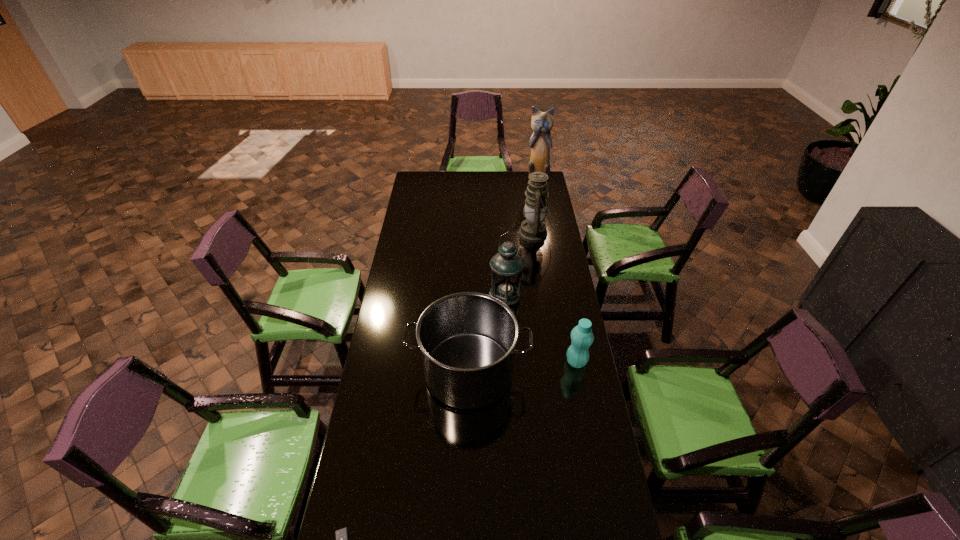
Locate an element on the screen. This screenshot has width=960, height=540. vacant space at the left edge is located at coordinates (403, 265).

The height and width of the screenshot is (540, 960). In order to click on vacant space at the right edge of the desktop in this screenshot , I will do `click(553, 280)`.

The image size is (960, 540). In order to click on vacant area that lies between the second farthest object and the bottle in this screenshot , I will do `click(556, 298)`.

This screenshot has height=540, width=960. I want to click on free space between the bottle and the cat, so click(x=557, y=272).

The image size is (960, 540). Find the location of `free area in between the bottle and the tallest object`. free area in between the bottle and the tallest object is located at coordinates (557, 272).

Image resolution: width=960 pixels, height=540 pixels. I want to click on free spot between the left oil lamp and the cat, so click(521, 238).

Locate which object is the third closest to the leftmost object. Please provide its 2D coordinates. Your answer should be formatted as a tuple, i.e. [(x, y)], where the tuple contains the x and y coordinates of a point satisfying the conditions above.

[(507, 266)]

Where is `the fourth closest object to the third farthest object`? the fourth closest object to the third farthest object is located at coordinates (542, 122).

Where is `free spot that satisfies the following two spatial constraints: 1. on the back side of the right oil lamp; 2. on the left side of the saucepan`? This screenshot has height=540, width=960. free spot that satisfies the following two spatial constraints: 1. on the back side of the right oil lamp; 2. on the left side of the saucepan is located at coordinates (472, 234).